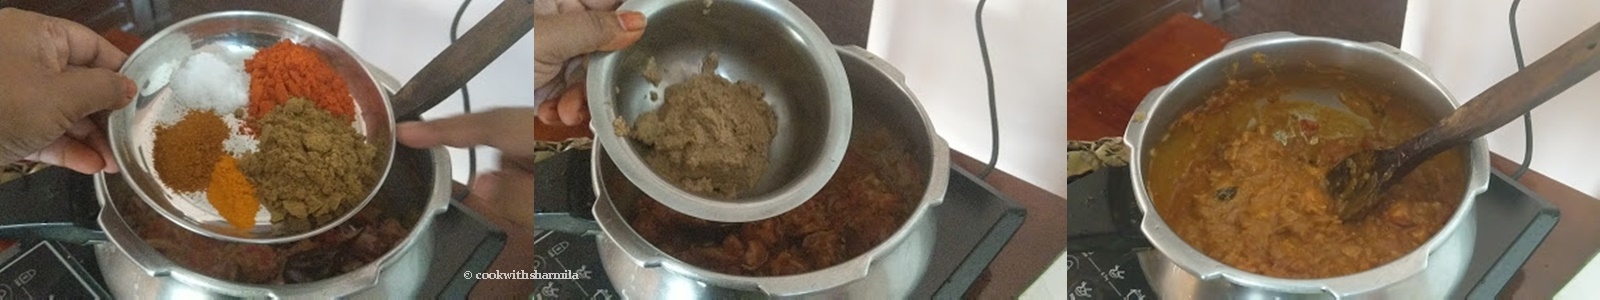
The image size is (1600, 300). Find the location of `stovetop`. stovetop is located at coordinates (557, 253).